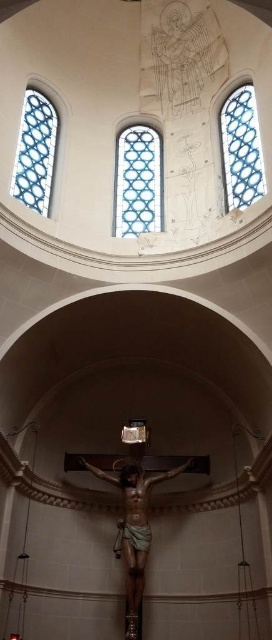
In the scene shown: Who is higher up, blue stained glass at center or blue stained glass at left?

blue stained glass at left is higher up.

Which is in front, point (128, 132) or point (35, 113)?

Point (35, 113)

Is point (133, 161) positioned before point (22, 138)?

No, (133, 161) is further to viewer.

Identify the location of blue stained glass at center. (137, 180).

Who is more forward, (233, 177) or (38, 193)?

Point (38, 193)

Consider the image. Between blue stained glass at upper right and blue stained glass at left, which one is positioned lower?

blue stained glass at upper right

Between point (224, 188) and point (26, 120), which one is positioned behind?

Point (26, 120)

The image size is (272, 640). What are the coordinates of `blue stained glass at upper right` in the screenshot? It's located at (240, 148).

Is blue stained glass at center shorter than blue stained glass at upper right?

In fact, blue stained glass at center may be taller than blue stained glass at upper right.

Which is in front, point (156, 131) or point (248, 128)?

Point (248, 128) is in front.

In the scene shown: Measure the distance between blue stained glass at center and camera.

blue stained glass at center and camera are 69.91 meters apart from each other.

I want to click on blue stained glass at center, so click(x=137, y=180).